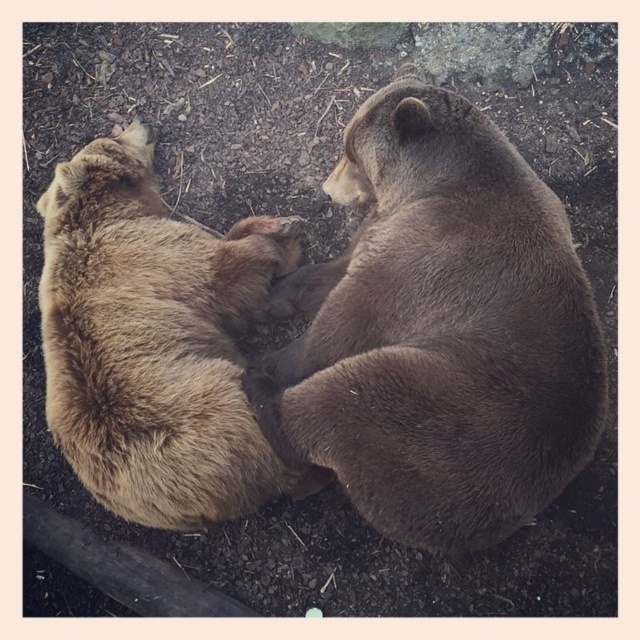
You are standing in front of the image of two bears lying together. There are two points marked in the image. The first point is at coordinates point [472,200] and the second point is at point [118,193]. Which of these points is closer to you?

Point [472,200] is closer to the viewer than point [118,193].